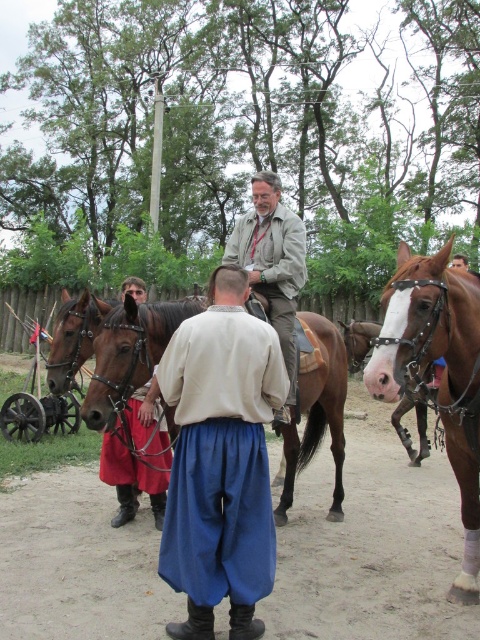
You are organizing a historical reenactment event and need to arrange the blue cotton robe at center and the brown glossy horse at center in a row for a photo. Which object should be placed first if you want the wider object to be on the right side?

The brown glossy horse at center is wider than the blue cotton robe at center, so place the brown glossy horse at center on the right side and the blue cotton robe at center on the left side.

You are a photographer positioned in front of the historical reenactment scene. You want to take a photo focusing on the brown glossy horse at center and the light brown leather jacket at center. Which object will appear larger in your photo?

The brown glossy horse at center will appear larger in the photo because it is closer to the viewer than the light brown leather jacket at center.